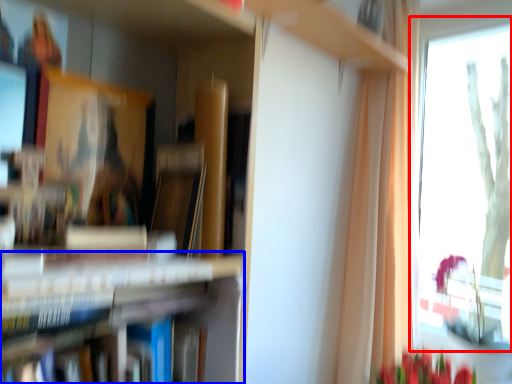
Question: Which object is further to the camera taking this photo, window (highlighted by a red box) or bookshelf (highlighted by a blue box)?

Choices:
 (A) window
 (B) bookshelf

Answer: (A)